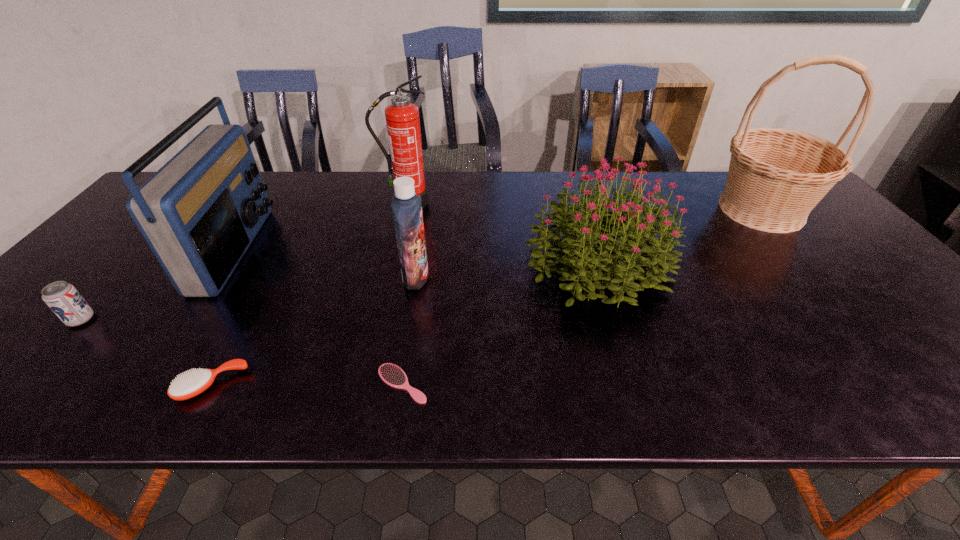
You are a GUI agent. You are given a task and a screenshot of the screen. Output one action in this format:
    pyautogui.click(x=<x>, y=<y>)
    Task: Click on the free point between the radio receiver and the shorter hairbrush
    The height and width of the screenshot is (540, 960).
    Given the screenshot: What is the action you would take?
    pyautogui.click(x=319, y=316)

You are a GUI agent. You are given a task and a screenshot of the screen. Output one action in this format:
    pyautogui.click(x=<x>, y=<y>)
    Task: Click on the free spot between the shortest object and the shampoo
    The image size is (960, 540).
    Given the screenshot: What is the action you would take?
    pyautogui.click(x=409, y=330)

At what (x,y) coordinates should I click in order to perform the action: click on vacant space in between the shortest object and the seventh object from left to right. Please return your answer as a coordinate pair (x, y). Looking at the image, I should click on (500, 324).

Find the location of `blank region between the seventh object from left to right and the rightmost object`. blank region between the seventh object from left to right and the rightmost object is located at coordinates (680, 237).

This screenshot has width=960, height=540. I want to click on blank region between the shampoo and the sixth tallest object, so click(x=249, y=298).

Find the location of `vacant point located between the second object from right to left and the rightmost object`. vacant point located between the second object from right to left and the rightmost object is located at coordinates (680, 237).

Where is `the third closest object to the third object from left to right`? The image size is (960, 540). the third closest object to the third object from left to right is located at coordinates (64, 300).

Locate which object ranks second in proximity to the shortest object. Please provide its 2D coordinates. Your answer should be formatted as a tuple, i.e. [(x, y)], where the tuple contains the x and y coordinates of a point satisfying the conditions above.

[(621, 260)]

I want to click on free space that satisfies the following two spatial constraints: 1. on the front-facing side of the bouquet; 2. on the right side of the fire extinguisher, so click(x=392, y=265).

At what (x,y) coordinates should I click in order to perform the action: click on free spot that satisfies the following two spatial constraints: 1. on the back side of the left hairbrush; 2. on the left side of the basket. Please return your answer as a coordinate pair (x, y). Looking at the image, I should click on (304, 210).